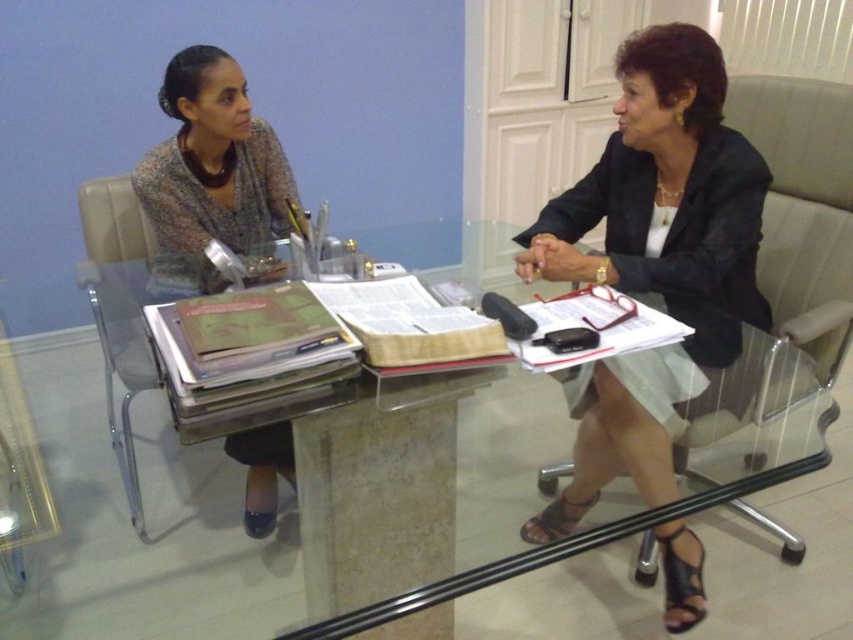
Question: Can you confirm if matte black jacket at center is smaller than matte gray sweater at left?

Choices:
 (A) no
 (B) yes

Answer: (A)

Question: Which of the following is the farthest from the observer?

Choices:
 (A) pyautogui.click(x=253, y=243)
 (B) pyautogui.click(x=729, y=355)
 (C) pyautogui.click(x=457, y=246)

Answer: (C)

Question: Can you confirm if matte gray sweater at left is positioned above transparent glass table at center?

Choices:
 (A) yes
 (B) no

Answer: (A)

Question: Among these points, which one is nearest to the camera?

Choices:
 (A) (231, 209)
 (B) (618, 198)
 (C) (627, 106)
 (D) (492, 260)

Answer: (C)

Question: Which object appears farthest from the camera in this image?

Choices:
 (A) matte gray sweater at left
 (B) transparent glass table at center

Answer: (B)

Question: Does matte black jacket at center have a greater width compared to black matte business suit at right?

Choices:
 (A) no
 (B) yes

Answer: (B)